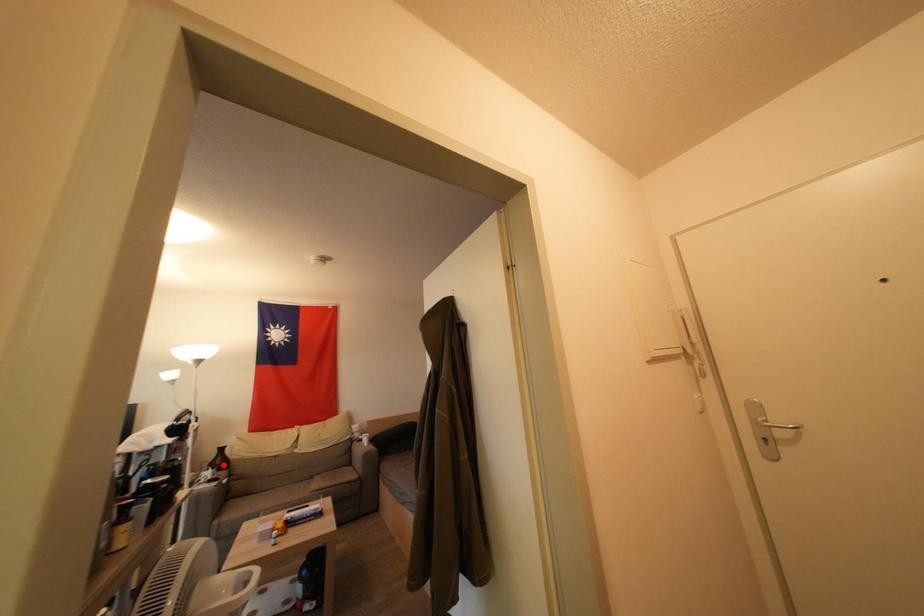
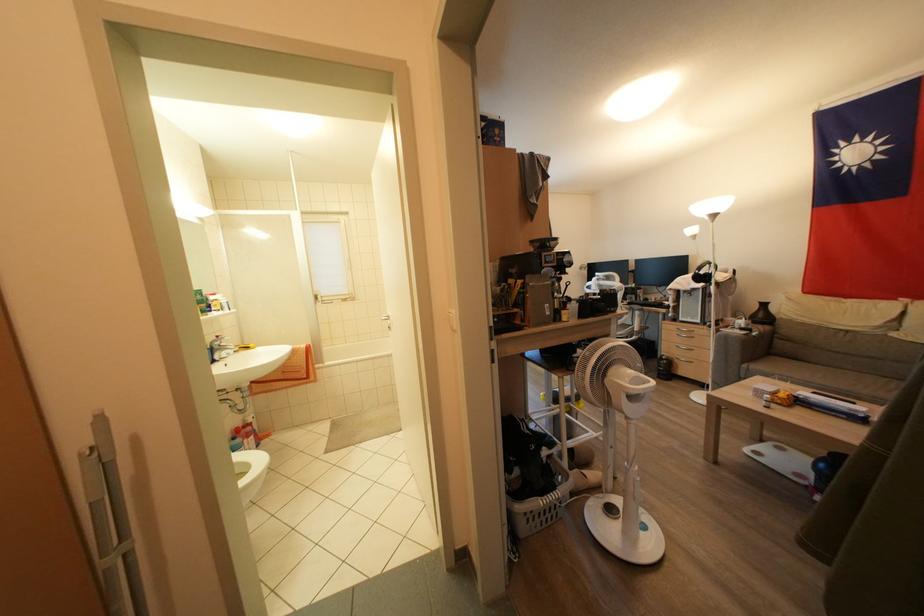
Question: I am providing you with two images of the same scene from different viewpoints. A red point is marked on the first image. At the location where the point appears in image 1, is it still visible in image 2?

Choices:
 (A) Yes
 (B) No

Answer: (A)